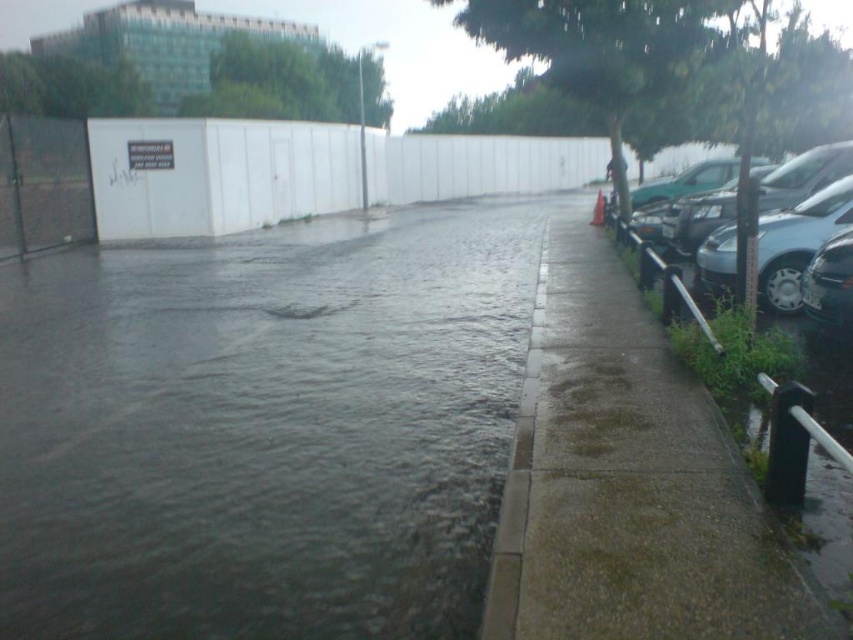
Consider the image. You are a delivery person trying to park your van between the satin silver car at right and the metallic silver car at right. Your van is 2 meters tall. Can you fit between them vertically?

The satin silver car at right is taller than the metallic silver car at right. Since the satin silver car is the tallest, and the description doesn not specify its exact height, we cannot determine if your van can fit vertically between them.

You are standing at the center of the paved road in the image. Which direction should you walk to reach the green concrete sidewalk at right located at point (628,481)?

The green concrete sidewalk at right is located at point (628,481), so you should walk towards the right side of the image to reach it.

You are a pedestrian standing on the sidewalk next to the low metal railing. You see two cars parked on the right side of the road, the satin silver car at right and the metallic silver car at right. Which car is closer to the road surface?

The satin silver car at right is located below the metallic silver car at right, so it is closer to the road surface.